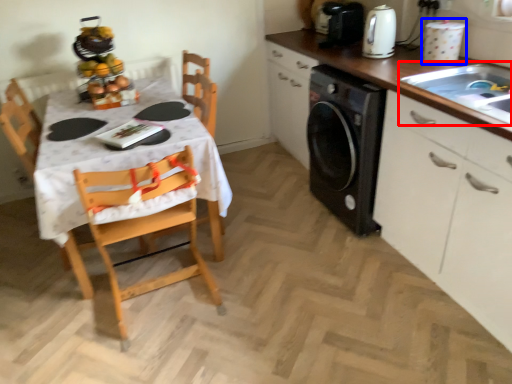
Question: Among these objects, which one is nearest to the camera, sink (highlighted by a red box) or appliance (highlighted by a blue box)?

Choices:
 (A) sink
 (B) appliance

Answer: (A)